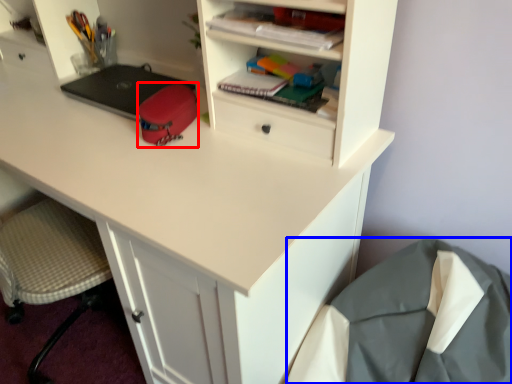
Question: Which point is closer to the camera, stationery (highlighted by a red box) or sleeping bag (highlighted by a blue box)?

Choices:
 (A) stationery
 (B) sleeping bag

Answer: (B)